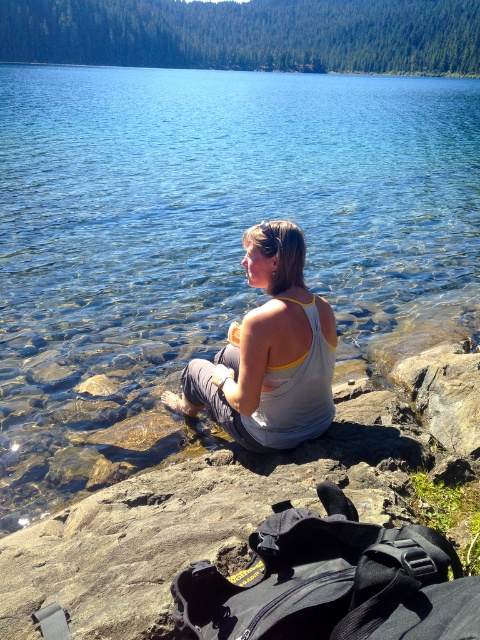
Is white cotton tank top at center to the left of gray rock at right from the viewer's perspective?

Yes, white cotton tank top at center is to the left of gray rock at right.

The image size is (480, 640). What do you see at coordinates (269, 353) in the screenshot? I see `white cotton tank top at center` at bounding box center [269, 353].

Image resolution: width=480 pixels, height=640 pixels. In order to click on white cotton tank top at center in this screenshot , I will do `click(269, 353)`.

This screenshot has height=640, width=480. Find the location of `white cotton tank top at center`. white cotton tank top at center is located at coordinates (269, 353).

Is clear water at center below gray rock at right?

Actually, clear water at center is above gray rock at right.

Is point (328, 184) positioned after point (456, 349)?

Yes, it is.

Describe the element at coordinates (207, 243) in the screenshot. The height and width of the screenshot is (640, 480). I see `clear water at center` at that location.

Locate an element on the screen. clear water at center is located at coordinates (207, 243).

Who is taller, clear water at center or white cotton tank top at center?

Standing taller between the two is clear water at center.

Is clear water at center above white cotton tank top at center?

Correct, clear water at center is located above white cotton tank top at center.

Locate an element on the screen. The height and width of the screenshot is (640, 480). clear water at center is located at coordinates (207, 243).